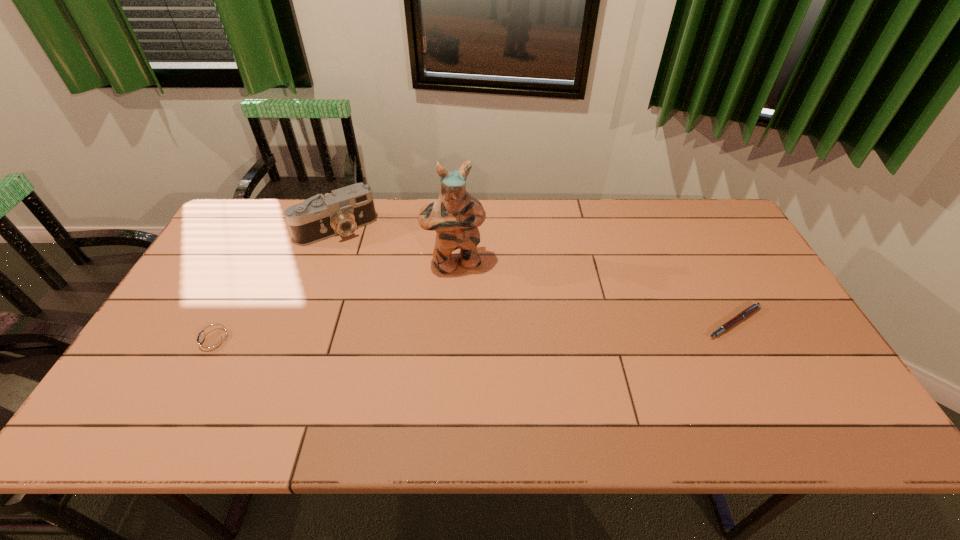
Locate an element on the screen. The height and width of the screenshot is (540, 960). the leftmost object is located at coordinates (212, 342).

You are a GUI agent. You are given a task and a screenshot of the screen. Output one action in this format:
    pyautogui.click(x=<x>, y=<y>)
    Task: Click on the watch
    This screenshot has width=960, height=540.
    Given the screenshot: What is the action you would take?
    pyautogui.click(x=212, y=342)

Image resolution: width=960 pixels, height=540 pixels. I want to click on the rightmost object, so tap(754, 307).

You are a GUI agent. You are given a task and a screenshot of the screen. Output one action in this format:
    pyautogui.click(x=<x>, y=<y>)
    Task: Click on the shortest object
    The height and width of the screenshot is (540, 960).
    Given the screenshot: What is the action you would take?
    pyautogui.click(x=754, y=307)

This screenshot has width=960, height=540. Find the location of `the third object from right to left`. the third object from right to left is located at coordinates (341, 212).

This screenshot has height=540, width=960. Find the location of `the second tallest object`. the second tallest object is located at coordinates click(341, 212).

I want to click on the tallest object, so click(455, 216).

Find the location of `the third object from left to right`. the third object from left to right is located at coordinates (455, 216).

Locate an element on the screen. vacant space located on the face of the second shortest object is located at coordinates (155, 342).

Identify the location of vacant point located 0.060m at the nib of the shortest object. click(754, 359).